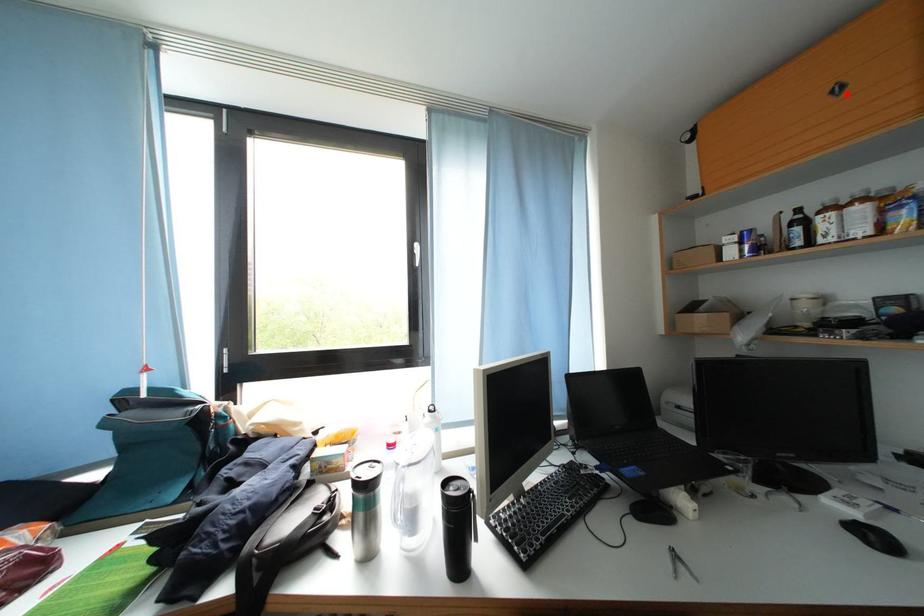
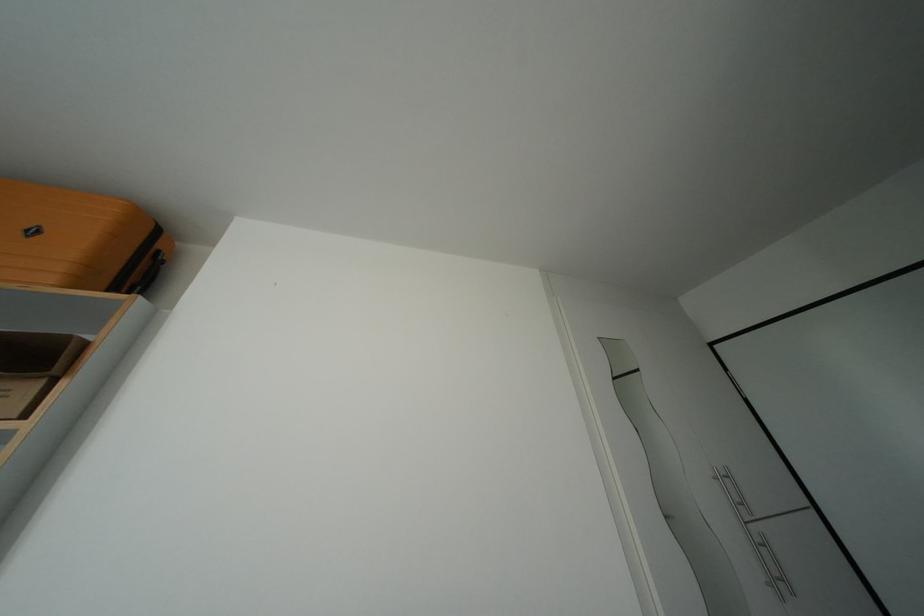
Locate, in the second image, the point that corresponds to the highlighted location in the first image.

(42, 237)